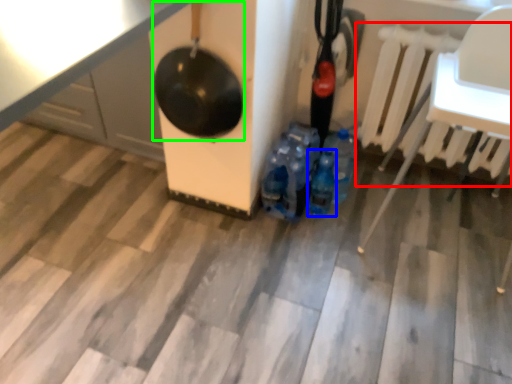
Question: Which object is positioned closest to radiator (highlighted by a red box)? Select from bottle (highlighted by a blue box) and wok (highlighted by a green box).

Choices:
 (A) bottle
 (B) wok

Answer: (A)